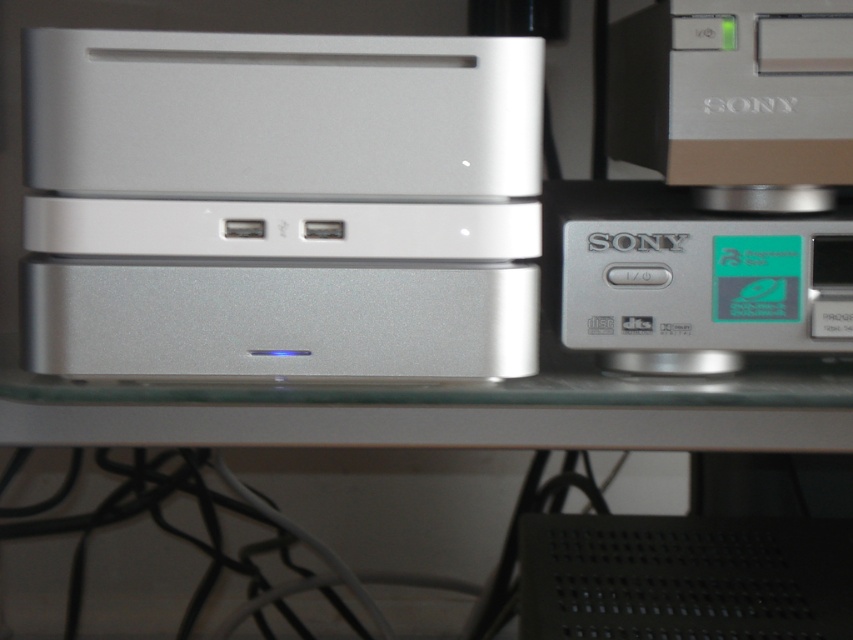
Is satin silver computer at center to the right of satin silver computer at upper right from the viewer's perspective?

Incorrect, satin silver computer at center is not on the right side of satin silver computer at upper right.

Is point (50, 99) closer to camera compared to point (686, 104)?

Yes, it is.

In order to click on satin silver computer at center in this screenshot , I will do `click(280, 204)`.

Is point (357, 193) positioned in front of point (67, 273)?

No, it is not.

Does satin silver computer at center have a lesser width compared to satin silver speaker at center?

Incorrect, satin silver computer at center's width is not less than satin silver speaker at center's.

Where is `satin silver computer at center`? This screenshot has width=853, height=640. satin silver computer at center is located at coordinates (280, 204).

Which of these two, satin silver drive at center or silver metallic sony cd player at right, stands shorter?

satin silver drive at center

What do you see at coordinates (280, 115) in the screenshot? I see `satin silver drive at center` at bounding box center [280, 115].

Find the location of `satin silver drive at center`. satin silver drive at center is located at coordinates (280, 115).